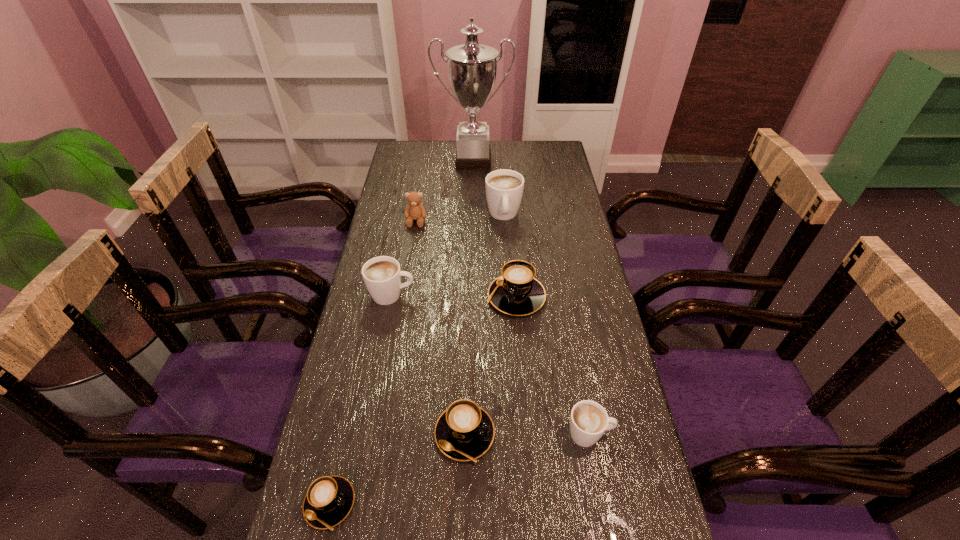
Where is `empty space that is in between the second farthest black cappuccino and the smallest white cappuccino`? Image resolution: width=960 pixels, height=540 pixels. empty space that is in between the second farthest black cappuccino and the smallest white cappuccino is located at coordinates (527, 434).

Locate an element on the screen. Image resolution: width=960 pixels, height=540 pixels. empty location between the second smallest white cappuccino and the smallest white cappuccino is located at coordinates (491, 364).

In order to click on blank region between the farthest black cappuccino and the nearest cappuccino in this screenshot , I will do `click(422, 400)`.

Locate an element on the screen. The width and height of the screenshot is (960, 540). unoccupied area between the farthest white cappuccino and the leftmost white cappuccino is located at coordinates (447, 255).

Find the location of `free space between the second nearest black cappuccino and the biggest black cappuccino`. free space between the second nearest black cappuccino and the biggest black cappuccino is located at coordinates (491, 365).

Locate which object ranks seventh in proximity to the biggest black cappuccino. Please provide its 2D coordinates. Your answer should be formatted as a tuple, i.e. [(x, y)], where the tuple contains the x and y coordinates of a point satisfying the conditions above.

[(472, 67)]

Identify which object is the third nearest to the second farthest black cappuccino. Please provide its 2D coordinates. Your answer should be formatted as a tuple, i.e. [(x, y)], where the tuple contains the x and y coordinates of a point satisfying the conditions above.

[(517, 292)]

Locate an element on the screen. Image resolution: width=960 pixels, height=540 pixels. cappuccino that stands as the third closest to the smallest black cappuccino is located at coordinates (382, 275).

Locate an element on the screen. The image size is (960, 540). the fourth closest cappuccino relative to the rightmost object is located at coordinates (382, 275).

Locate an element on the screen. The image size is (960, 540). white cappuccino that is the closest to the second smallest black cappuccino is located at coordinates (589, 420).